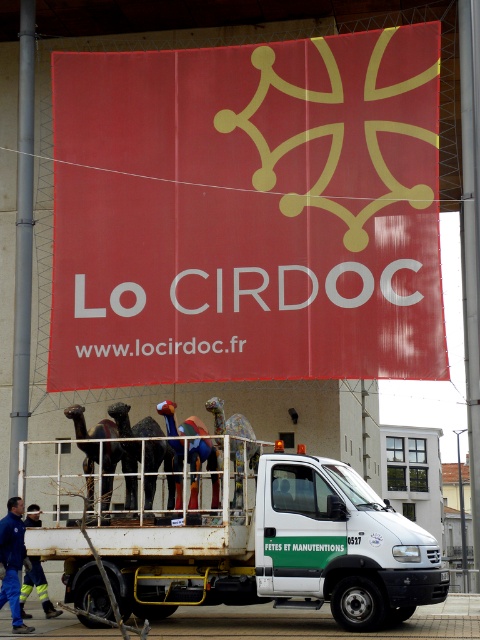
You are a delivery driver who needs to ensure the white matte truck at center can pass through a narrow alley that is as wide as the red matte sign at upper center. Can the truck pass through the alley without needing to adjust its position?

The red matte sign at upper center might be wider than white matte truck at center, so there is a possibility that the truck cannot pass through the alley without adjustments. It is recommended to check the exact measurements before proceeding.

You are an artist trying to set up a sculpture display. You see a blue fabric man at lower left and a yellow reflective safety vest at lower left. Which object is closer to the left edge of the image?

The yellow reflective safety vest at lower left is closer to the left edge of the image because the blue fabric man at lower left is positioned on its right side.

You are a pedestrian standing in front of the scene. You see the white matte truck at center and the yellow reflective safety vest at lower left. Which object is located to the right side of the other?

The white matte truck at center is located to the right of the yellow reflective safety vest at lower left.